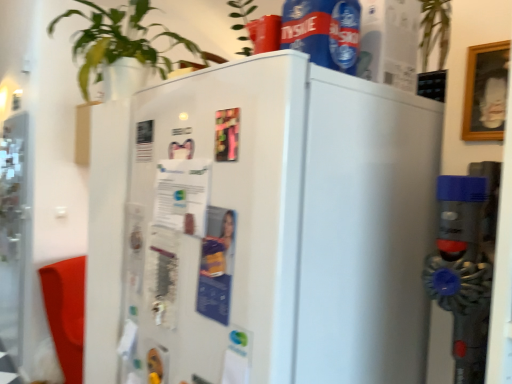
Question: Should I look upward or downward to see green leafy plant at upper left?

Choices:
 (A) down
 (B) up

Answer: (B)

Question: Can you confirm if transparent glass screen door at left is taller than blue plastic bottle at upper center?

Choices:
 (A) no
 (B) yes

Answer: (B)

Question: Is transparent glass screen door at left aimed at blue plastic bottle at upper center?

Choices:
 (A) yes
 (B) no

Answer: (B)

Question: Considering the relative sizes of transparent glass screen door at left and blue plastic bottle at upper center in the image provided, is transparent glass screen door at left shorter than blue plastic bottle at upper center?

Choices:
 (A) no
 (B) yes

Answer: (A)

Question: From the image's perspective, is transparent glass screen door at left beneath blue plastic bottle at upper center?

Choices:
 (A) no
 (B) yes

Answer: (B)

Question: Does transparent glass screen door at left have a lesser width compared to blue plastic bottle at upper center?

Choices:
 (A) no
 (B) yes

Answer: (A)

Question: Is transparent glass screen door at left behind blue plastic bottle at upper center?

Choices:
 (A) yes
 (B) no

Answer: (A)

Question: Considering the relative sizes of green leafy plant at upper left and white glossy refrigerator at center in the image provided, is green leafy plant at upper left bigger than white glossy refrigerator at center?

Choices:
 (A) no
 (B) yes

Answer: (A)

Question: Is green leafy plant at upper left facing away from white glossy refrigerator at center?

Choices:
 (A) no
 (B) yes

Answer: (A)

Question: From the image's perspective, is green leafy plant at upper left on white glossy refrigerator at center?

Choices:
 (A) yes
 (B) no

Answer: (A)

Question: From a real-world perspective, is green leafy plant at upper left physically below white glossy refrigerator at center?

Choices:
 (A) yes
 (B) no

Answer: (B)

Question: Is green leafy plant at upper left wider than white glossy refrigerator at center?

Choices:
 (A) no
 (B) yes

Answer: (A)

Question: Could you tell me if green leafy plant at upper left is turned towards white glossy refrigerator at center?

Choices:
 (A) yes
 (B) no

Answer: (B)

Question: From the image's perspective, is white glossy refrigerator at center under green leafy plant at upper left?

Choices:
 (A) yes
 (B) no

Answer: (A)